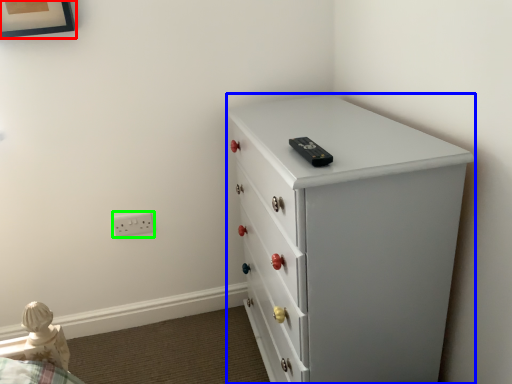
Question: Which object is the closest to the picture frame (highlighted by a red box)? Choose among these: chest of drawers (highlighted by a blue box) or electric outlet (highlighted by a green box).

Choices:
 (A) chest of drawers
 (B) electric outlet

Answer: (B)